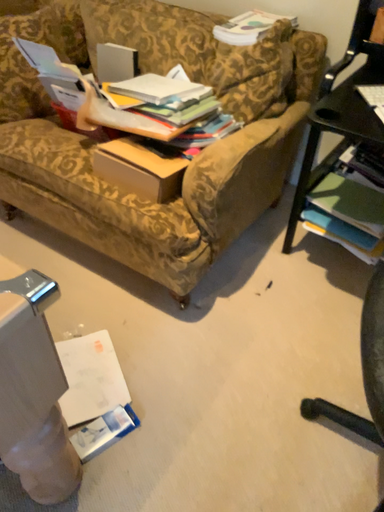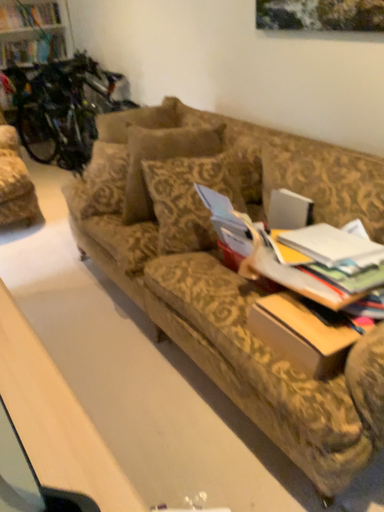
Question: How did the camera likely rotate when shooting the video?

Choices:
 (A) rotated upward
 (B) rotated downward

Answer: (A)